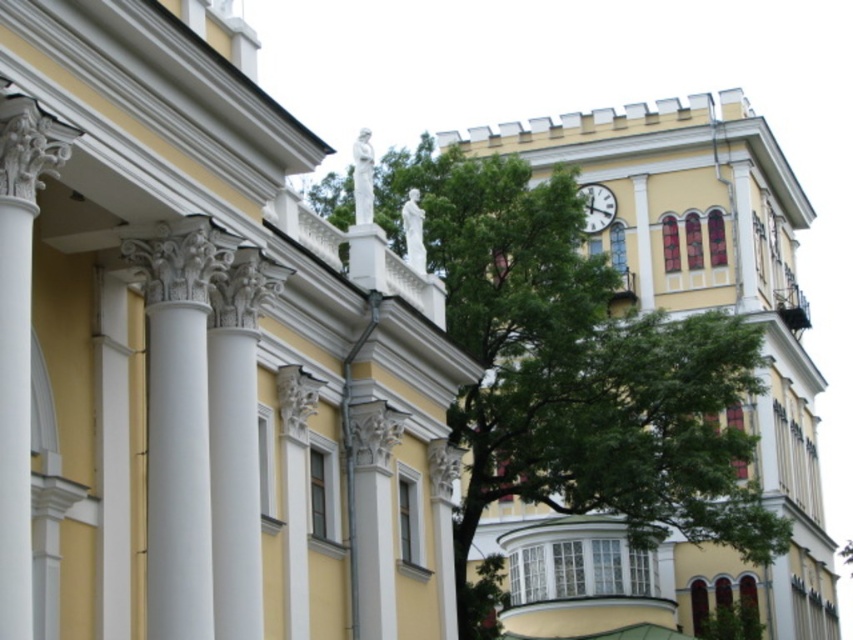
Question: Does green leafy tree at upper center come behind white glossy clock at upper center?

Choices:
 (A) yes
 (B) no

Answer: (B)

Question: Does white marble columns at upper left have a smaller size compared to green leafy tree at upper center?

Choices:
 (A) no
 (B) yes

Answer: (B)

Question: Which point is farther from the camera taking this photo?

Choices:
 (A) (103, 522)
 (B) (606, 202)
 (C) (26, 467)
 (D) (601, 298)

Answer: (B)

Question: Is white marble column at left to the left of white glossy clock at upper center from the viewer's perspective?

Choices:
 (A) yes
 (B) no

Answer: (A)

Question: Which is nearer to the white marble column at left?

Choices:
 (A) green leafy tree at upper center
 (B) white glossy clock at upper center

Answer: (A)

Question: Considering the real-world distances, which object is closest to the white marble columns at upper left?

Choices:
 (A) white glossy clock at upper center
 (B) white marble column at left

Answer: (B)